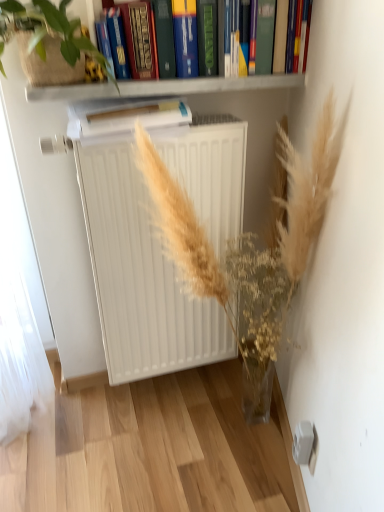
The height and width of the screenshot is (512, 384). In order to click on translucent glass vase at center in this screenshot , I will do `click(250, 237)`.

What is the approximate width of hardcover book at upper center?

19.56 centimeters.

I want to click on hardcover book at upper center, so click(279, 40).

Measure the distance between point (166, 90) and camera.

They are 1.12 meters apart.

Measure the distance between white paper at center, which appears as the first paperback book when ordered from the bottom, and camera.

white paper at center, which appears as the first paperback book when ordered from the bottom, and camera are 3.62 feet apart from each other.

You are a GUI agent. You are given a task and a screenshot of the screen. Output one action in this format:
    pyautogui.click(x=<x>, y=<y>)
    Task: Click on the white matte radiator at center
    
    Given the screenshot: What is the action you would take?
    pyautogui.click(x=139, y=275)

What do you see at coordinates (117, 42) in the screenshot? Image resolution: width=384 pixels, height=512 pixels. I see `hardcover book at upper center, the 2th paperback book from the bottom` at bounding box center [117, 42].

The image size is (384, 512). I want to click on translucent glass vase at center, so click(x=250, y=237).

Which of these two, white matte radiator at center or hardcover book at upper center, the 2th paperback book from the bottom, is wider?

white matte radiator at center.

Is white matte radiator at center next to hardcover book at upper center, the 2th paperback book from the bottom, and touching it?

No, white matte radiator at center is not touching hardcover book at upper center, the 2th paperback book from the bottom.

Does point (78, 156) lie in front of point (113, 57)?

That is False.

Could you measure the distance between white matte radiator at center and hardcover book at upper center, the 2th paperback book from the bottom?

22.46 inches.

Which object is more forward, white paper at center, which appears as the first paperback book when ordered from the bottom, or green leafy plant at upper left?

green leafy plant at upper left is more forward.

From the image's perspective, is white paper at center, which appears as the first paperback book when ordered from the bottom, located above green leafy plant at upper left?

Incorrect, from the image's perspective, white paper at center, which appears as the first paperback book when ordered from the bottom, is lower than green leafy plant at upper left.

Considering the sizes of objects white paper at center, which appears as the 2th paperback book when viewed from the top, and green leafy plant at upper left in the image provided, who is thinner, white paper at center, which appears as the 2th paperback book when viewed from the top, or green leafy plant at upper left?

white paper at center, which appears as the 2th paperback book when viewed from the top.

Would you say white paper at center, which appears as the 2th paperback book when viewed from the top, is inside or outside green leafy plant at upper left?

white paper at center, which appears as the 2th paperback book when viewed from the top, is spatially situated outside green leafy plant at upper left.

Is white paper at center, which appears as the first paperback book when ordered from the bottom, positioned behind white matte shelf at upper center?

Yes, white paper at center, which appears as the first paperback book when ordered from the bottom, is further from the camera.

Who is bigger, white paper at center, which appears as the 2th paperback book when viewed from the top, or white matte shelf at upper center?

With larger size is white matte shelf at upper center.

Is white paper at center, which appears as the 2th paperback book when viewed from the top, touching white matte shelf at upper center?

Yes, the surface of white paper at center, which appears as the 2th paperback book when viewed from the top, is in contact with white matte shelf at upper center.

Consider the image. Does white paper at center, which appears as the first paperback book when ordered from the bottom, turn towards white matte shelf at upper center?

No, white paper at center, which appears as the first paperback book when ordered from the bottom, does not turn towards white matte shelf at upper center.

Is white paper at center, which appears as the first paperback book when ordered from the bottom, facing towards hardcover book at upper center?

No, white paper at center, which appears as the first paperback book when ordered from the bottom, does not turn towards hardcover book at upper center.

From the image's perspective, who appears lower, white paper at center, which appears as the 2th paperback book when viewed from the top, or hardcover book at upper center?

white paper at center, which appears as the 2th paperback book when viewed from the top.

How far apart are white paper at center, which appears as the first paperback book when ordered from the bottom, and hardcover book at upper center?

white paper at center, which appears as the first paperback book when ordered from the bottom, and hardcover book at upper center are 43.01 centimeters apart from each other.

Which object is wider, white paper at center, which appears as the first paperback book when ordered from the bottom, or hardcover book at upper center?

white paper at center, which appears as the first paperback book when ordered from the bottom, is wider.

There is a green leafy plant at upper left. At what (x,y) coordinates should I click in order to perform the action: click on the 1st paperback book below it (from a real-world perspective). Please return your answer as a coordinate pair (x, y). This screenshot has width=384, height=512. Looking at the image, I should click on (117, 42).

From the image's perspective, relative to green leafy plant at upper left, is hardcover book at upper center, the 2th paperback book from the bottom, above or below?

hardcover book at upper center, the 2th paperback book from the bottom, is above green leafy plant at upper left.

Does hardcover book at upper center, the 2th paperback book from the bottom, have a lesser height compared to green leafy plant at upper left?

Correct, hardcover book at upper center, the 2th paperback book from the bottom, is not as tall as green leafy plant at upper left.

Does hardcover book at upper center, the first paperback book when ordered from top to bottom, have a larger size compared to green leafy plant at upper left?

No, hardcover book at upper center, the first paperback book when ordered from top to bottom, is not bigger than green leafy plant at upper left.

Between white matte shelf at upper center and white paper at center, which appears as the 2th paperback book when viewed from the top, which one has smaller width?

white matte shelf at upper center is thinner.

Based on the photo, from a real-world perspective, between white matte shelf at upper center and white paper at center, which appears as the first paperback book when ordered from the bottom, who is vertically higher?

From a 3D spatial view, white matte shelf at upper center is above.

From the image's perspective, is white matte shelf at upper center above white paper at center, which appears as the 2th paperback book when viewed from the top?

Indeed, from the image's perspective, white matte shelf at upper center is shown above white paper at center, which appears as the 2th paperback book when viewed from the top.

Does white matte shelf at upper center turn towards white paper at center, which appears as the first paperback book when ordered from the bottom?

No.

From the picture: Considering the sizes of translucent glass vase at center and white matte shelf at upper center in the image, is translucent glass vase at center taller or shorter than white matte shelf at upper center?

Clearly, translucent glass vase at center is taller compared to white matte shelf at upper center.

Is translucent glass vase at center not near white matte shelf at upper center?

No, there isn't a large distance between translucent glass vase at center and white matte shelf at upper center.

Looking at this image, can you confirm if translucent glass vase at center is thinner than white matte shelf at upper center?

No, translucent glass vase at center is not thinner than white matte shelf at upper center.

Does point (323, 178) come farther from viewer compared to point (158, 94)?

No.

This screenshot has height=512, width=384. In order to click on radiator on the right side of hardcover book at upper center, the first paperback book when ordered from top to bottom in this screenshot , I will do `click(139, 275)`.

This screenshot has height=512, width=384. Find the location of `paperback book that is below the green leafy plant at upper left (from the image's perspective)`. paperback book that is below the green leafy plant at upper left (from the image's perspective) is located at coordinates [x=124, y=117].

In the scene shown: Based on their spatial positions, is white matte radiator at center or translucent glass vase at center further from hardcover book at upper center?

white matte radiator at center.

When comparing their distances from white matte radiator at center, does white paper at center, which appears as the 2th paperback book when viewed from the top, or green leafy plant at upper left seem further?

green leafy plant at upper left is positioned further to the anchor white matte radiator at center.

Looking at the image, which one is located further to hardcover book at upper center, white matte shelf at upper center or white matte radiator at center?

The object further to hardcover book at upper center is white matte radiator at center.

Based on their spatial positions, is white paper at center, which appears as the 2th paperback book when viewed from the top, or translucent glass vase at center further from white matte shelf at upper center?

translucent glass vase at center is further to white matte shelf at upper center.

When comparing their distances from green leafy plant at upper left, does white paper at center, which appears as the first paperback book when ordered from the bottom, or white matte shelf at upper center seem closer?

white matte shelf at upper center lies closer to green leafy plant at upper left than the other object.

Looking at the image, which one is located further to white matte radiator at center, white paper at center, which appears as the first paperback book when ordered from the bottom, or white matte shelf at upper center?

Based on the image, white matte shelf at upper center appears to be further to white matte radiator at center.

Looking at the image, which one is located closer to green leafy plant at upper left, white paper at center, which appears as the 2th paperback book when viewed from the top, or hardcover book at upper center?

Among the two, white paper at center, which appears as the 2th paperback book when viewed from the top, is located nearer to green leafy plant at upper left.

Considering their positions, is white matte radiator at center positioned closer to white paper at center, which appears as the first paperback book when ordered from the bottom, than hardcover book at upper center, the 2th paperback book from the bottom?

Among the two, hardcover book at upper center, the 2th paperback book from the bottom, is located nearer to white paper at center, which appears as the first paperback book when ordered from the bottom.

I want to click on window sill between hardcover book at upper center, the 2th paperback book from the bottom, and white matte radiator at center, in the vertical direction, so click(162, 87).

This screenshot has width=384, height=512. Find the location of `paperback book between hardcover book at upper center, the first paperback book when ordered from top to bottom, and white matte radiator at center vertically`. paperback book between hardcover book at upper center, the first paperback book when ordered from top to bottom, and white matte radiator at center vertically is located at coordinates (124, 117).

Find the location of a particular element. The height and width of the screenshot is (512, 384). vegetation between hardcover book at upper center and translucent glass vase at center vertically is located at coordinates (49, 31).

Identify the location of radiator between hardcover book at upper center, the 2th paperback book from the bottom, and translucent glass vase at center from top to bottom. (139, 275).